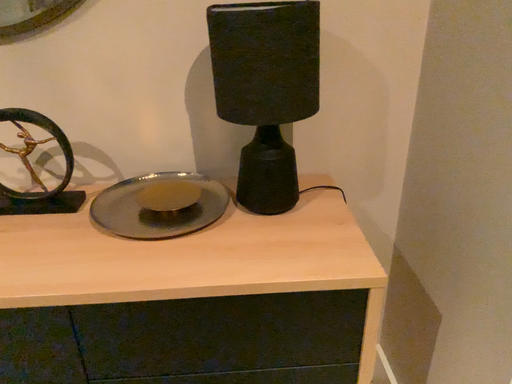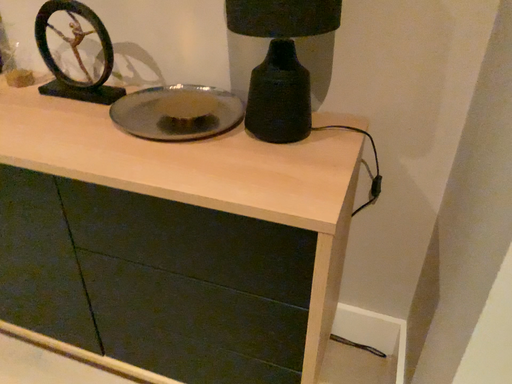
Question: Which way did the camera rotate in the video?

Choices:
 (A) rotated right
 (B) rotated left

Answer: (B)